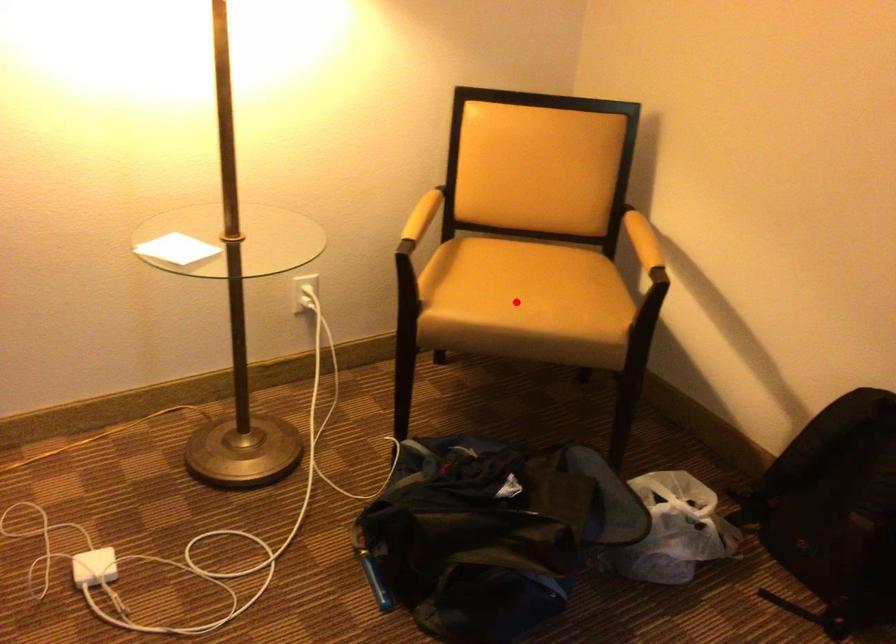
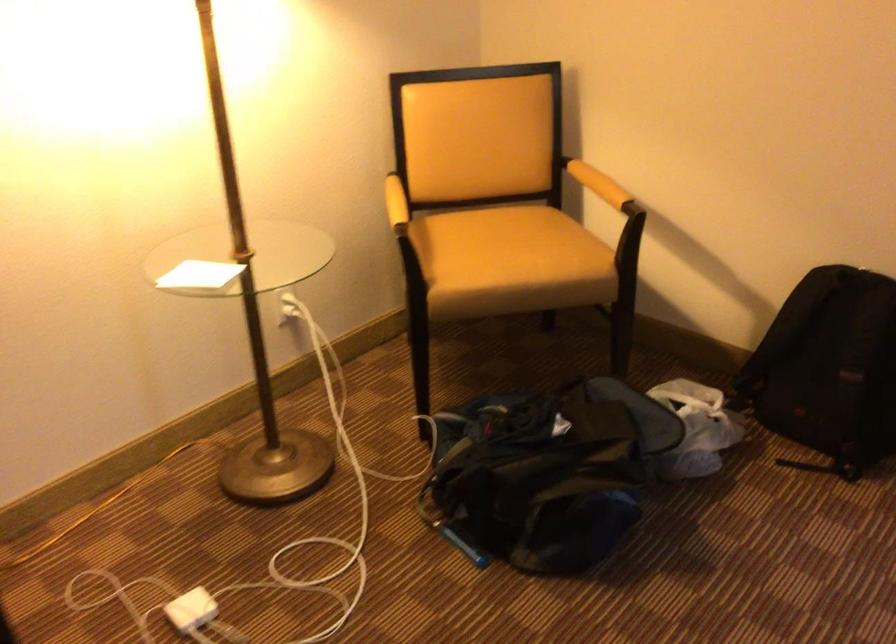
Where in the second image is the point corresponding to the highlighted location from the first image?

(510, 261)